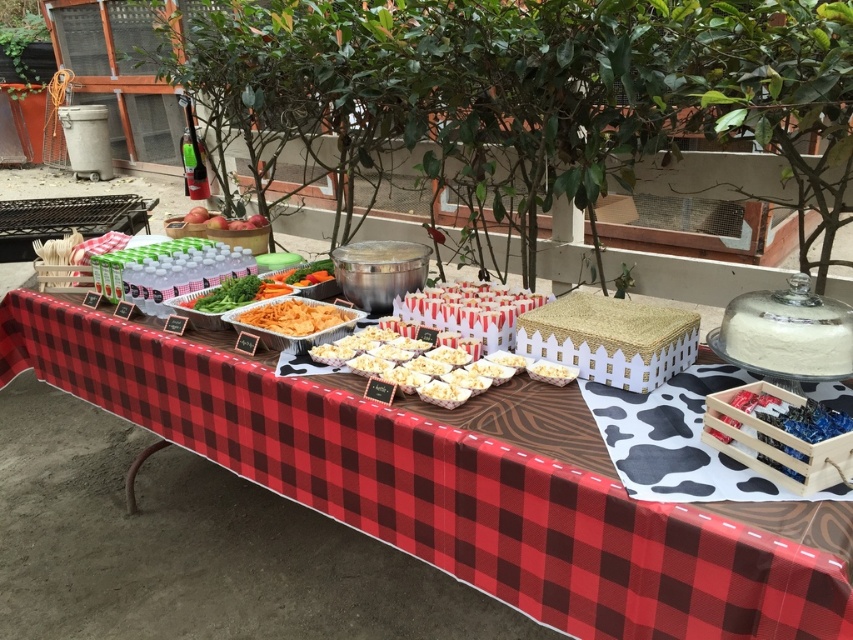
Question: Can you confirm if green leafy vegetables at center is smaller than golden crispy chips at center?

Choices:
 (A) yes
 (B) no

Answer: (B)

Question: Which object appears farthest from the camera in this image?

Choices:
 (A) wooden crate at lower right
 (B) green leafy vegetables at center

Answer: (B)

Question: Among these points, which one is nearest to the camera?

Choices:
 (A) (795, 442)
 (B) (221, 310)

Answer: (A)

Question: Which of the following is the farthest from the observer?

Choices:
 (A) (242, 300)
 (B) (70, 561)
 (C) (474, 317)

Answer: (B)

Question: Can you confirm if red plaid tablecloth at center is positioned above wooden crate at lower right?

Choices:
 (A) yes
 (B) no

Answer: (B)

Question: Does wooden crate at lower right lie in front of green leafy vegetables at center?

Choices:
 (A) no
 (B) yes

Answer: (B)